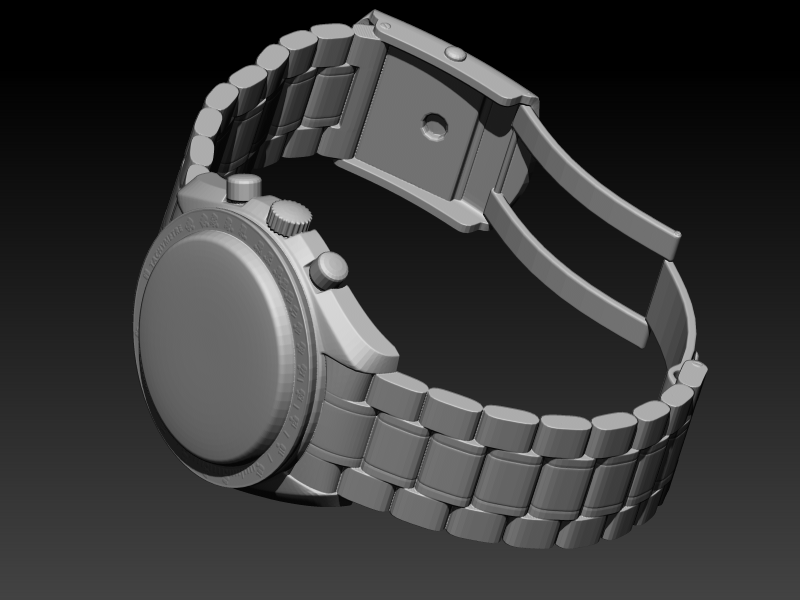
Locate an element on the screen. knob is located at coordinates (341, 273), (302, 223), (246, 183).